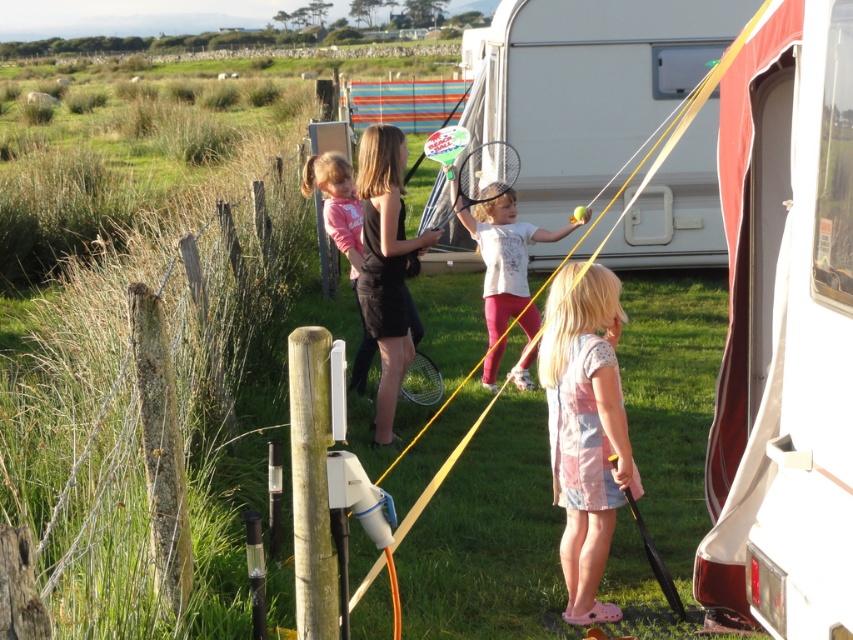
You are a photographer trying to capture the black matte dress at center in the image. Based on its coordinates, where should you focus your camera?

The black matte dress at center is located at coordinates point (386, 264), so you should focus your camera there.

You are a photographer trying to capture a candid shot of the black matte dress at center and the white matte tennis racket at center. Based on their positions, which object should you focus on first to ensure both are in the frame?

The black matte dress at center is located above the white matte tennis racket at center, so you should focus on the black matte dress at center first to ensure both are in the frame.

You are a child holding a 1.5 meter long toy ladder. You want to place it horizontally between the white matte tennis racket at center and the matte black tennis racket at center. Can the ladder fit between them without bending?

The distance between the white matte tennis racket at center and the matte black tennis racket at center is 1.62 meters. Since the ladder is 1.5 meters long, it can fit between them without bending.